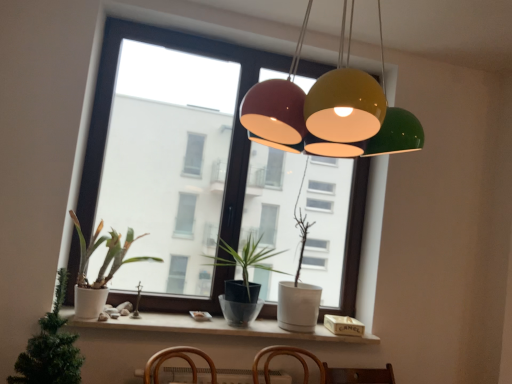
Question: From a real-world perspective, is white matte window sill at lower center above or below white matte pot at left, acting as the 2th houseplant starting from the back?

Choices:
 (A) above
 (B) below

Answer: (B)

Question: Is white matte window sill at lower center wider or thinner than white matte pot at left, acting as the 2th houseplant starting from the back?

Choices:
 (A) thin
 (B) wide

Answer: (A)

Question: Based on their relative distances, which object is nearer to the transparent glass window at center?

Choices:
 (A) white matte window sill at lower center
 (B) white matte pot at left, the 2th houseplant positioned from the front
 (C) matte black pot at center, the third houseplant from the front
 (D) white matte pot at left, which is the 1th houseplant in front-to-back order

Answer: (C)

Question: Estimate the real-world distances between objects in this image. Which object is closer to the transparent glass window at center?

Choices:
 (A) white matte window sill at lower center
 (B) white matte pot at left, which is the 1th houseplant in front-to-back order
 (C) matte black pot at center, arranged as the 1th houseplant when viewed from the back
 (D) white matte pot at left, the 2th houseplant positioned from the front

Answer: (C)